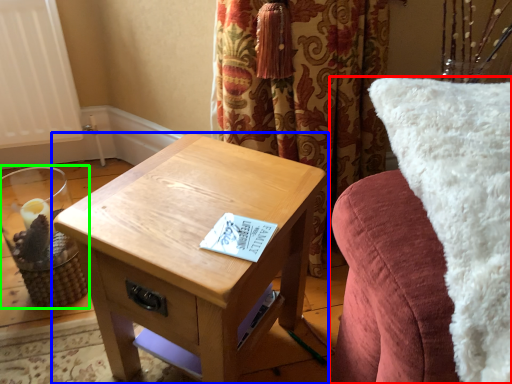
Question: Considering the real-world distances, which object is closest to furniture (highlighted by a red box)? table (highlighted by a blue box) or candle holder (highlighted by a green box).

Choices:
 (A) table
 (B) candle holder

Answer: (A)